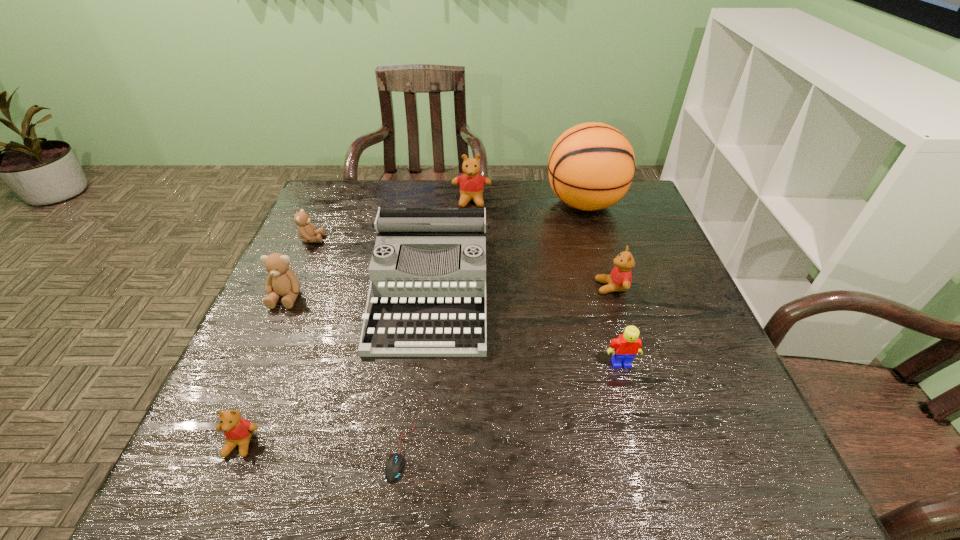
Locate an element on the screen. Image resolution: width=960 pixels, height=540 pixels. the tallest object is located at coordinates (591, 166).

Where is `orange basketball`? This screenshot has height=540, width=960. orange basketball is located at coordinates (591, 166).

This screenshot has width=960, height=540. In order to click on the tallest teddy bear in this screenshot , I will do `click(471, 184)`.

You are a GUI agent. You are given a task and a screenshot of the screen. Output one action in this format:
    pyautogui.click(x=<x>, y=<y>)
    Task: Click on the farthest teddy bear
    
    Given the screenshot: What is the action you would take?
    pyautogui.click(x=471, y=184)

The width and height of the screenshot is (960, 540). I want to click on typewriter, so click(427, 296).

Where is `the rightmost teddy bear`? This screenshot has width=960, height=540. the rightmost teddy bear is located at coordinates (620, 278).

Find the location of a particular element. the second farthest red teddy bear is located at coordinates (620, 278).

The width and height of the screenshot is (960, 540). In order to click on the bigger brown teddy bear in this screenshot , I will do `click(281, 281)`.

At what (x,y) coordinates should I click in order to perform the action: click on Lego. Please return your answer as a coordinate pair (x, y). The width and height of the screenshot is (960, 540). Looking at the image, I should click on (624, 348).

The height and width of the screenshot is (540, 960). Identify the location of yellow Lego. (624, 348).